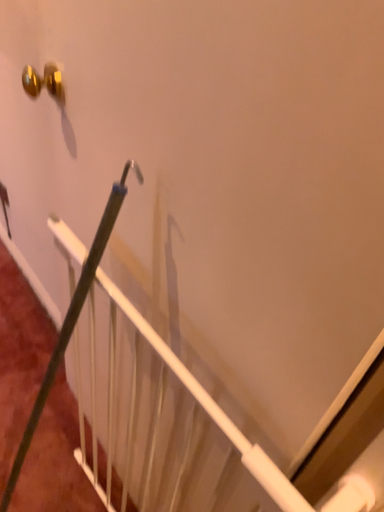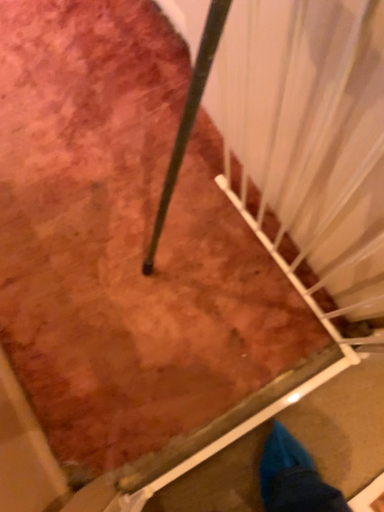
Question: How did the camera likely rotate when shooting the video?

Choices:
 (A) rotated left
 (B) rotated right

Answer: (A)